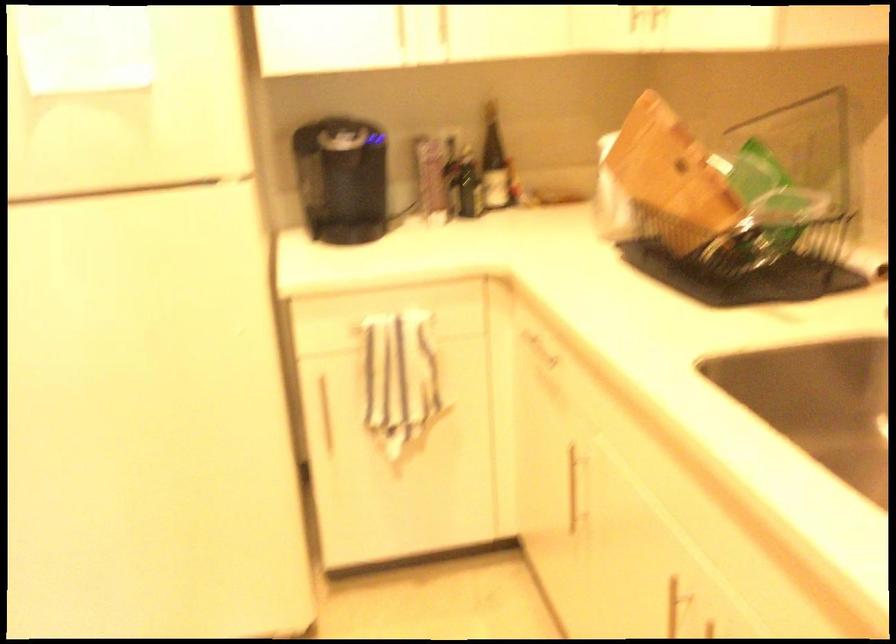
Find where to pull the cabinet towel bar. Please return your answer as a coordinate pair (x, y).

(323, 412)